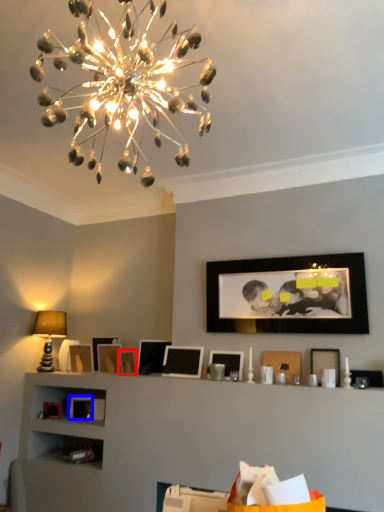
Question: Among these objects, which one is farthest to the camera, picture frame (highlighted by a red box) or picture frame (highlighted by a blue box)?

Choices:
 (A) picture frame
 (B) picture frame

Answer: (B)